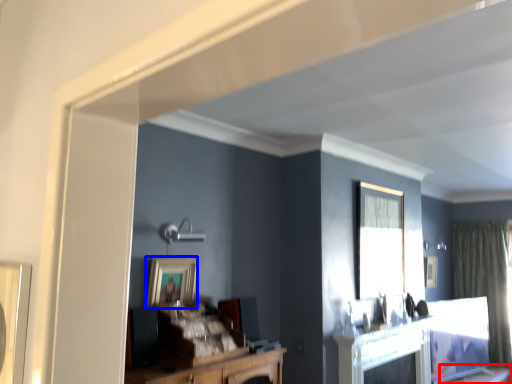
Question: Which object appears closest to the camera in this image, table (highlighted by a red box) or picture frame (highlighted by a blue box)?

Choices:
 (A) table
 (B) picture frame

Answer: (B)